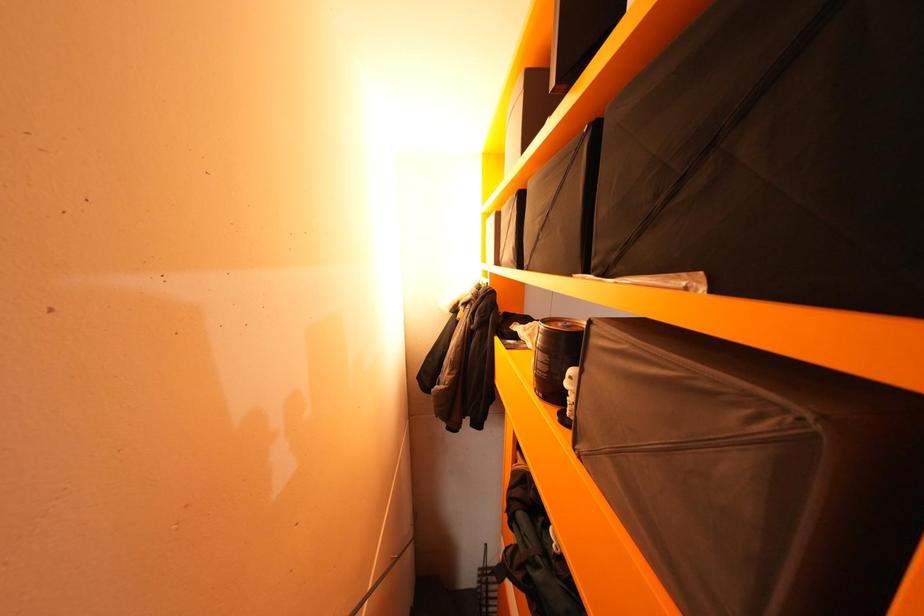
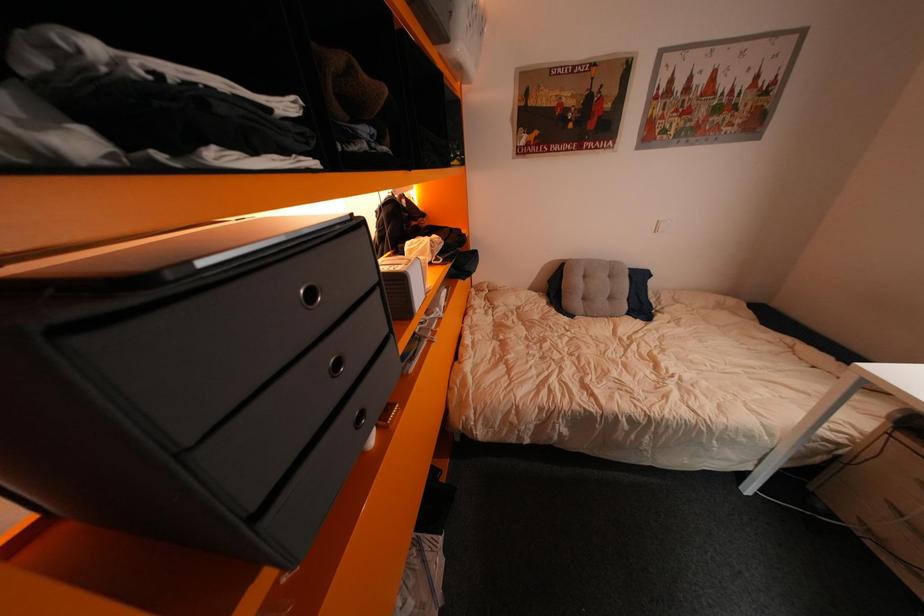
Question: The images are taken continuously from a first-person perspective. In which direction are you moving?

Choices:
 (A) Left
 (B) Right
 (C) Forward
 (D) Backward

Answer: (B)